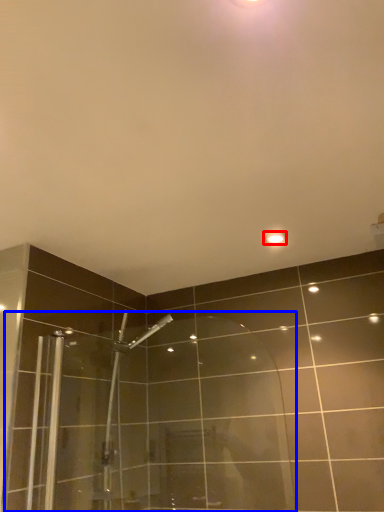
Question: Which of the following is the closest to the observer, light fixture (highlighted by a red box) or shower door (highlighted by a blue box)?

Choices:
 (A) light fixture
 (B) shower door

Answer: (B)